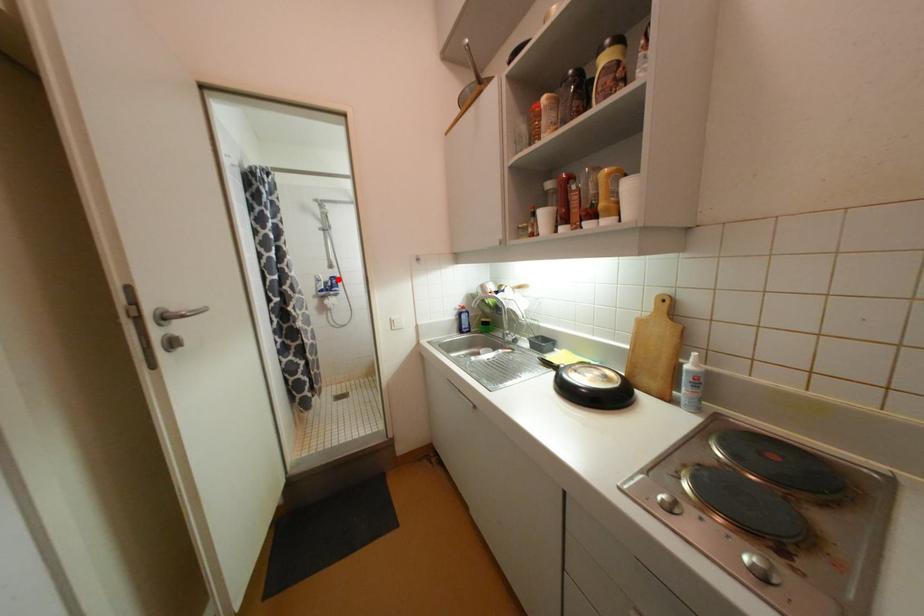
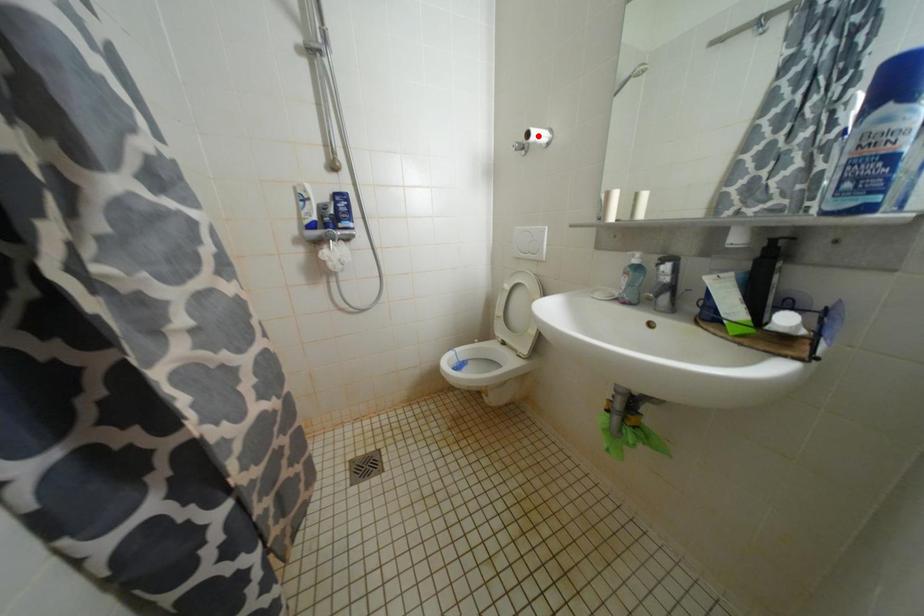
I am providing you with two images of the same scene from different viewpoints. A red point is marked on the first image and another point is marked on the second image. Do the highlighted points in image1 and image2 indicate the same real-world spot?

No